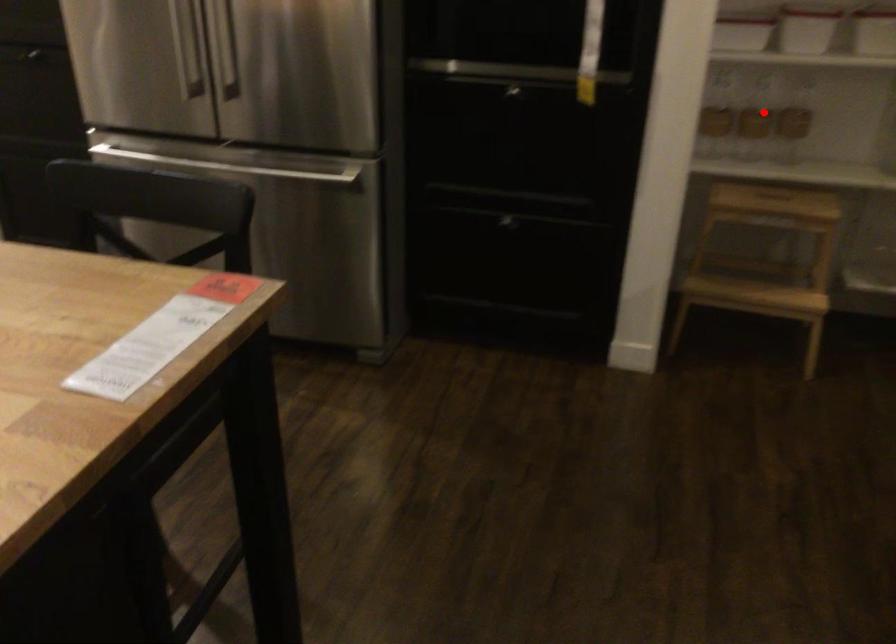
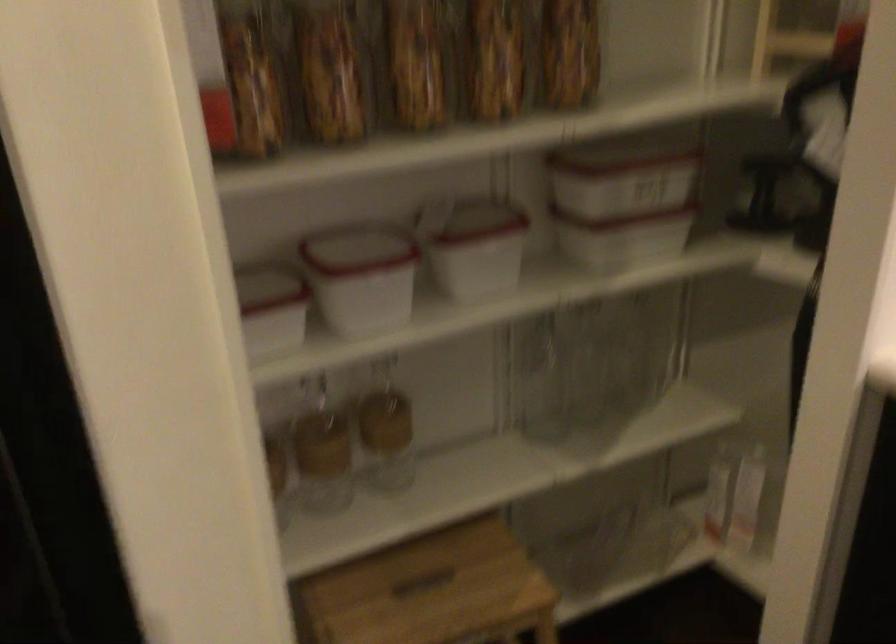
In the second image, find the point that corresponds to the highlighted location in the first image.

(322, 451)